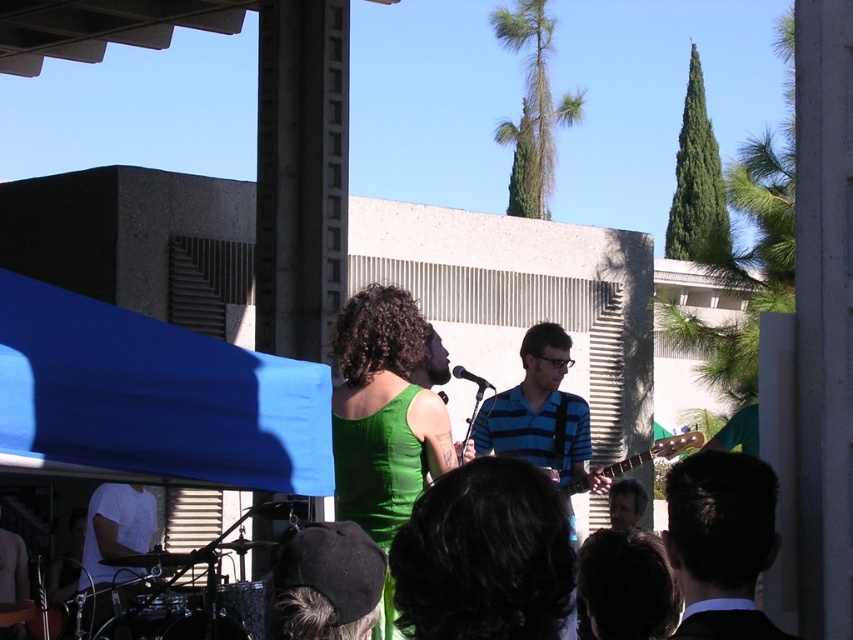
You are standing at the center of the stage where the performers are. You want to walk directly to the blue fabric canopy at left. Which direction should you walk?

Since the blue fabric canopy at left is located at point 0.623 in the x coordinate and 0.181 in the y coordinate, you should walk to the left and slightly forward to reach it.